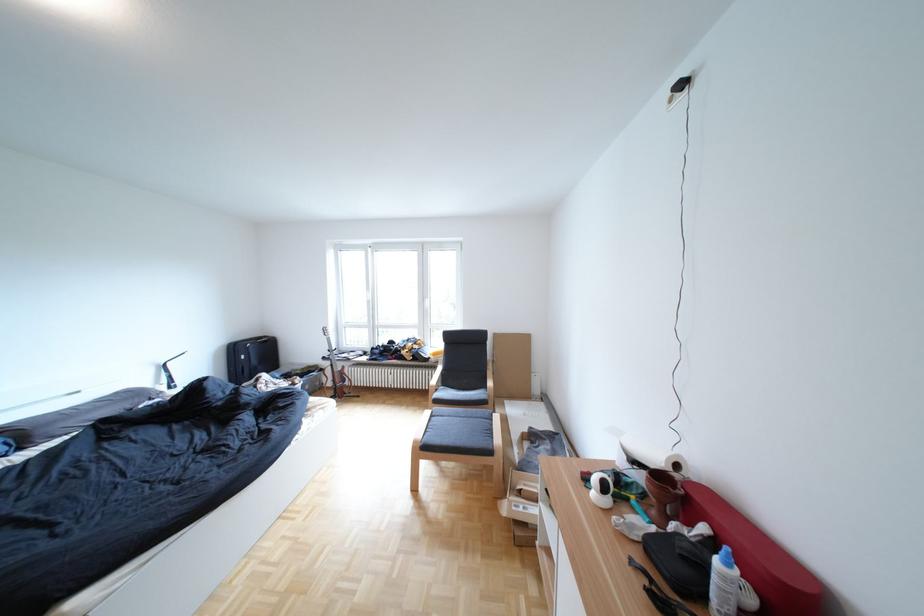
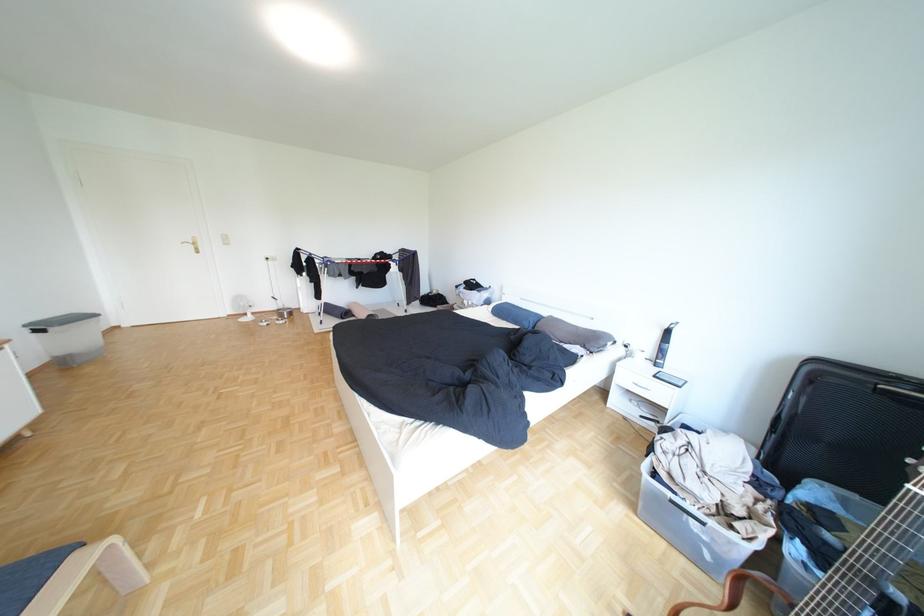
In the second image, find the point that corresponds to [166,400] in the first image.

(600, 347)